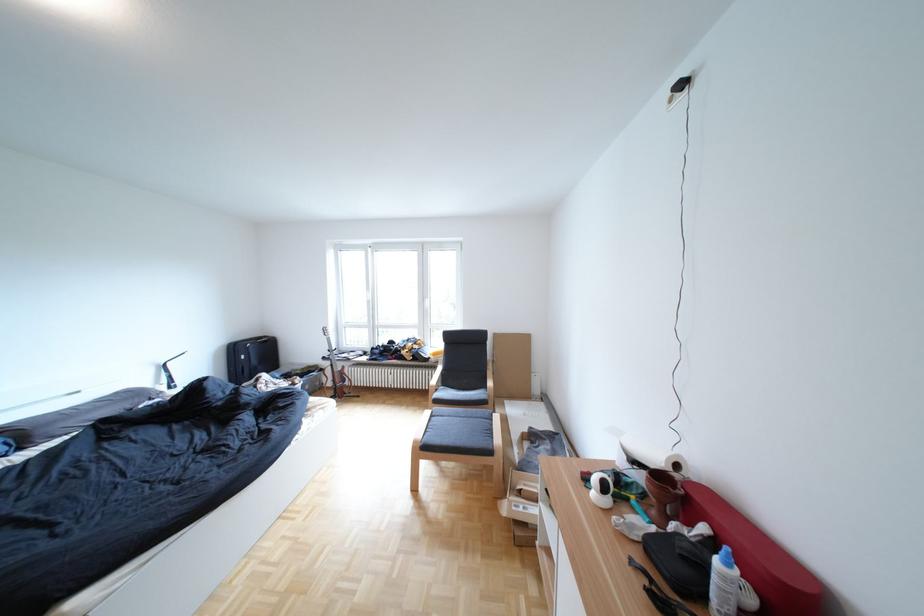
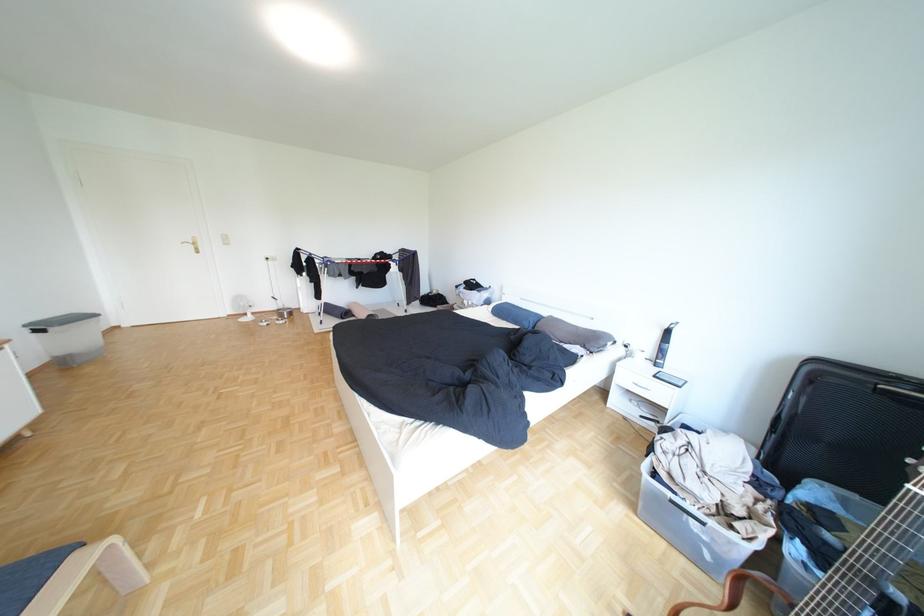
In the second image, find the point that corresponds to [166,400] in the first image.

(600, 347)